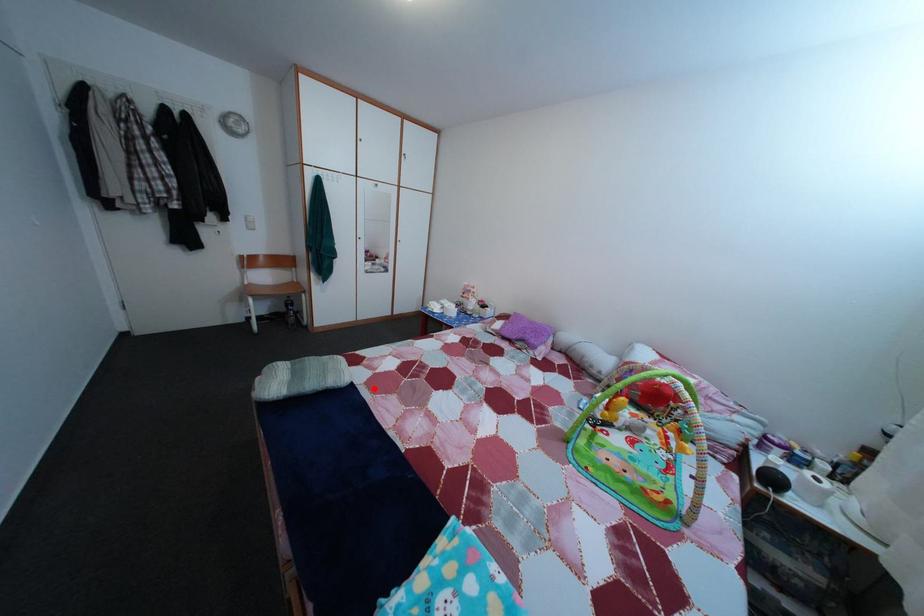
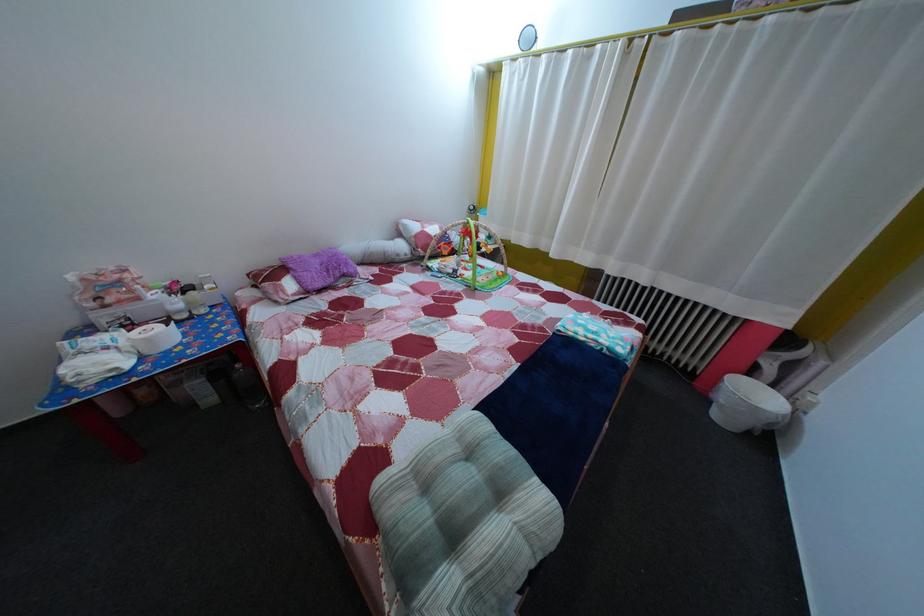
Find the pixel in the second image that matches the highlighted location in the first image.

(442, 432)